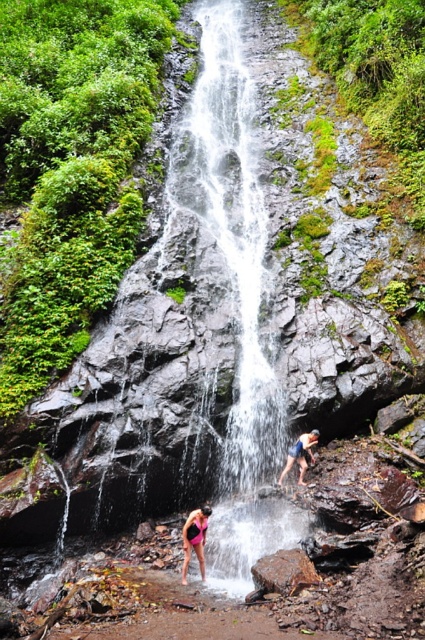
Question: Among these objects, which one is farthest from the camera?

Choices:
 (A) white textured water at center
 (B) pink matte swimsuit at lower center

Answer: (B)

Question: Is brown rough rock at center to the left of pink matte swimsuit at lower center from the viewer's perspective?

Choices:
 (A) yes
 (B) no

Answer: (B)

Question: Does brown rough rock at center have a larger size compared to matte skin person at center?

Choices:
 (A) yes
 (B) no

Answer: (B)

Question: Which point is farther to the camera?

Choices:
 (A) (297, 564)
 (B) (183, 564)

Answer: (B)

Question: Is white textured water at center above matte skin person at center?

Choices:
 (A) yes
 (B) no

Answer: (A)

Question: Which object appears closest to the camera in this image?

Choices:
 (A) matte skin person at center
 (B) white textured water at center
 (C) pink matte swimsuit at lower center

Answer: (B)